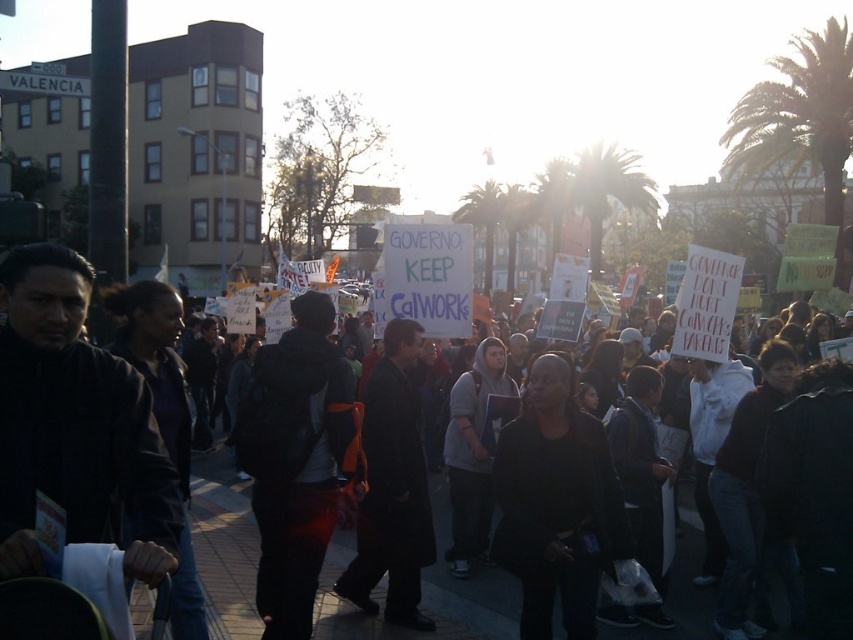
You are a photographer positioned at the origin point of the image. You want to capture a photo of the black matte jacket at center. What are the coordinates where you should aim your camera?

The coordinates to aim your camera are at point [556,504].